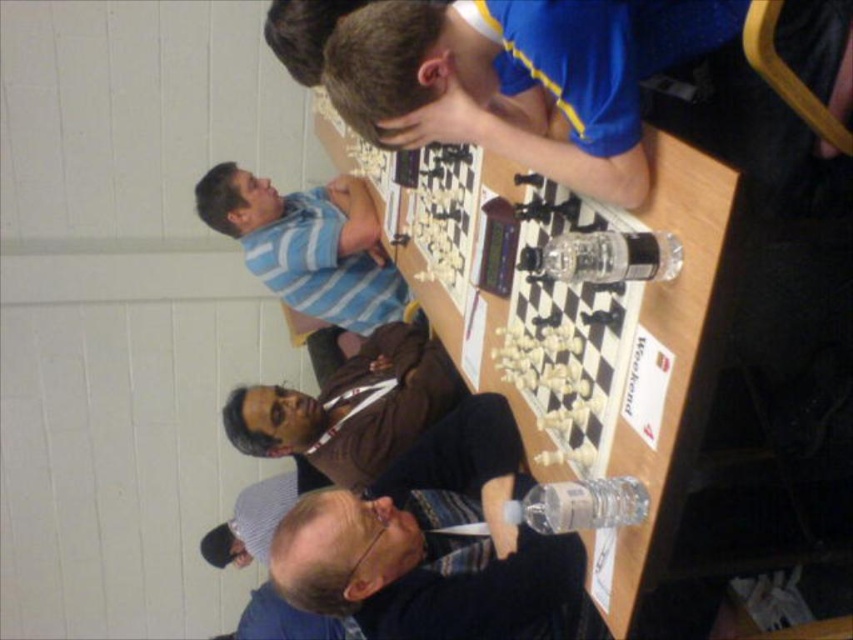
Identify the location of blue jersey at upper center. (519, 77).

Does blue jersey at upper center appear on the right side of striped fabric shirt at lower center?

Yes, blue jersey at upper center is to the right of striped fabric shirt at lower center.

Which is behind, point (454, 84) or point (300, 518)?

Positioned behind is point (300, 518).

The height and width of the screenshot is (640, 853). I want to click on blue jersey at upper center, so click(519, 77).

Does blue jersey at upper center lie in front of brown leather jacket at center?

Yes, it is in front of brown leather jacket at center.

Locate an element on the screen. The height and width of the screenshot is (640, 853). blue jersey at upper center is located at coordinates (519, 77).

Which is behind, point (531, 147) or point (283, 404)?

The point (283, 404) is behind.

Identify the location of blue jersey at upper center. This screenshot has height=640, width=853. (519, 77).

Who is higher up, brown leather jacket at center or blue striped shirt at upper left?

blue striped shirt at upper left is higher up.

Which of these two, brown leather jacket at center or blue striped shirt at upper left, stands shorter?

Standing shorter between the two is brown leather jacket at center.

Is point (389, 371) in front of point (248, 250)?

Yes, it is.

At what (x,y) coordinates should I click in order to perform the action: click on brown leather jacket at center. Please return your answer as a coordinate pair (x, y). Looking at the image, I should click on (350, 404).